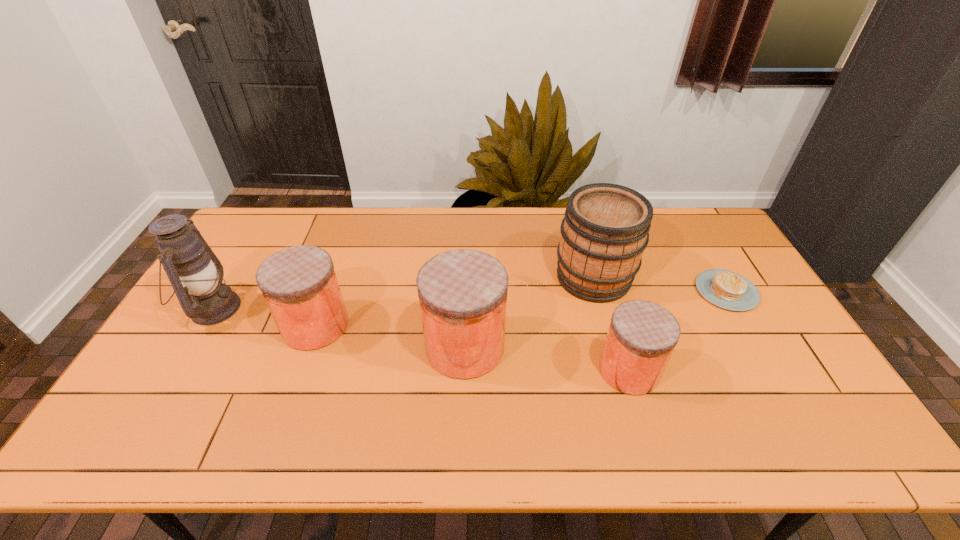
What are the coordinates of `the fourth tallest object` in the screenshot? It's located at (299, 284).

Image resolution: width=960 pixels, height=540 pixels. I want to click on the leftmost jar, so click(x=299, y=284).

Find the location of a particular element. This screenshot has height=540, width=960. the fourth object from right to left is located at coordinates (462, 293).

Identify the location of the rightmost jar. (642, 335).

At what (x,y) coordinates should I click in order to perform the action: click on the fifth tallest object. Please return your answer as a coordinate pair (x, y). Image resolution: width=960 pixels, height=540 pixels. Looking at the image, I should click on (642, 335).

You are a GUI agent. You are given a task and a screenshot of the screen. Output one action in this format:
    pyautogui.click(x=<x>, y=<y>)
    Task: Click on the cider
    
    Given the screenshot: What is the action you would take?
    pyautogui.click(x=605, y=230)

You are a GUI agent. You are given a task and a screenshot of the screen. Output one action in this format:
    pyautogui.click(x=<x>, y=<y>)
    Task: Click on the pancake
    The image size is (960, 540).
    Given the screenshot: What is the action you would take?
    pyautogui.click(x=726, y=289)

Where is `the shortest object`? This screenshot has height=540, width=960. the shortest object is located at coordinates (726, 289).

Image resolution: width=960 pixels, height=540 pixels. Identify the location of the leftmost object. (196, 274).

Find the location of `vacant space located 0.280m on the left of the second shortest jar`. vacant space located 0.280m on the left of the second shortest jar is located at coordinates (186, 326).